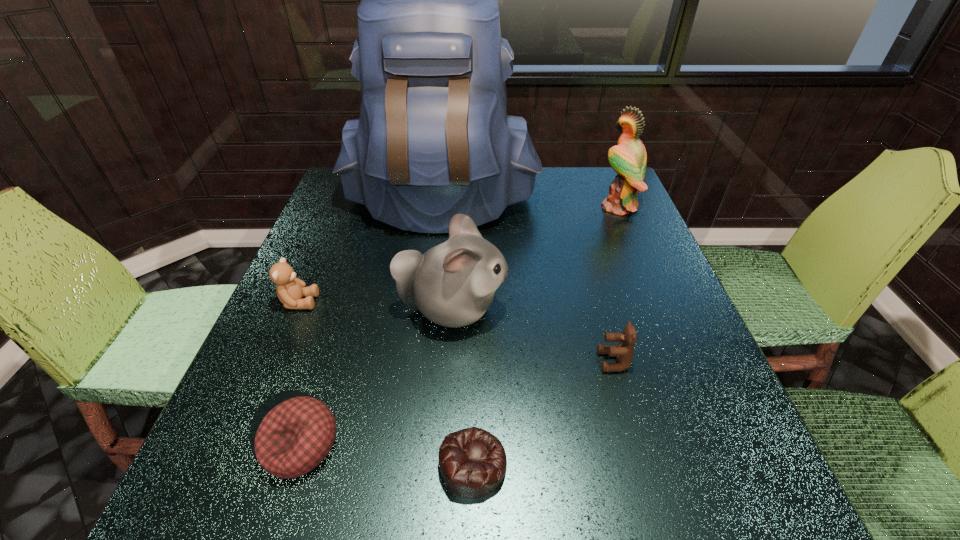
Where is `vacant space that satisfies the following two spatial constraints: 1. on the face of the third shortest object; 2. on the front side of the right beanbag`? The image size is (960, 540). vacant space that satisfies the following two spatial constraints: 1. on the face of the third shortest object; 2. on the front side of the right beanbag is located at coordinates pyautogui.click(x=643, y=464).

Identify the location of free location that satisfies the following two spatial constraints: 1. on the face of the right beanbag; 2. on the right side of the left teddy bear. The image size is (960, 540). (229, 464).

Image resolution: width=960 pixels, height=540 pixels. I want to click on blank area in the image that satisfies the following two spatial constraints: 1. on the face of the right beanbag; 2. on the right side of the farther teddy bear, so click(x=229, y=464).

Where is `free spot that satisfies the following two spatial constraints: 1. on the face of the hamster; 2. on the right side of the right beanbag`? This screenshot has width=960, height=540. free spot that satisfies the following two spatial constraints: 1. on the face of the hamster; 2. on the right side of the right beanbag is located at coordinates (442, 464).

Image resolution: width=960 pixels, height=540 pixels. Identify the location of vacant space that satisfies the following two spatial constraints: 1. on the face of the farther teddy bear; 2. on the right side of the taller beanbag. (238, 444).